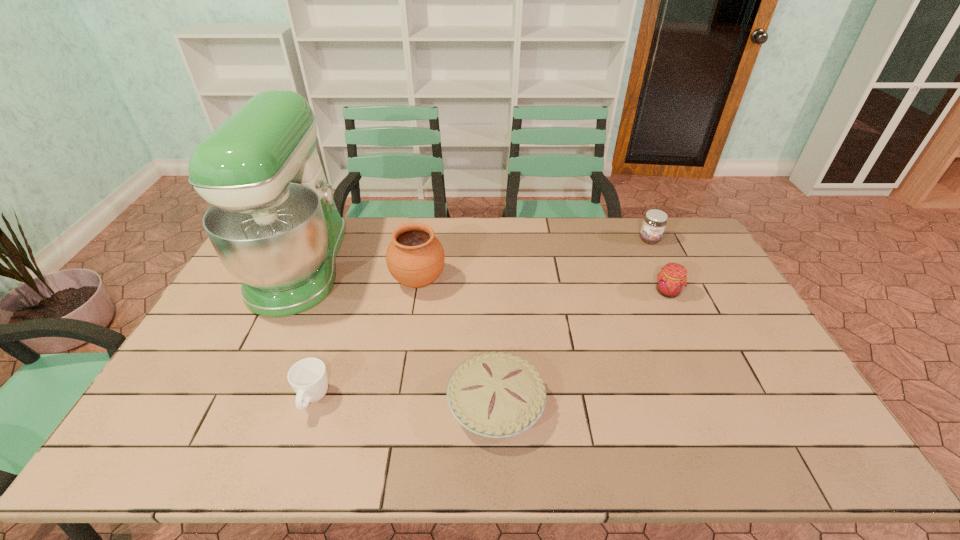
In the image, there is a desktop. In order to click on free space at the far edge in this screenshot , I will do `click(435, 233)`.

This screenshot has width=960, height=540. I want to click on free space at the near edge, so click(256, 463).

The height and width of the screenshot is (540, 960). In order to click on vacant space at the left edge in this screenshot , I will do (x=207, y=376).

Find the location of `free space at the right edge of the desktop`. free space at the right edge of the desktop is located at coordinates (701, 303).

I want to click on vacant position at the far right corner of the desktop, so click(675, 231).

Image resolution: width=960 pixels, height=540 pixels. I want to click on vacant space in between the pottery and the mixer, so click(360, 273).

This screenshot has height=540, width=960. Identify the location of free area in between the farther jam and the third object from left to right. pyautogui.click(x=534, y=260).

Image resolution: width=960 pixels, height=540 pixels. I want to click on unoccupied position between the nearer jam and the farther jam, so click(659, 266).

Locate an element on the screen. free space between the cup and the mixer is located at coordinates pyautogui.click(x=307, y=333).

Identify the location of vacant area that lies between the third object from right to left and the nearer jam. (582, 348).